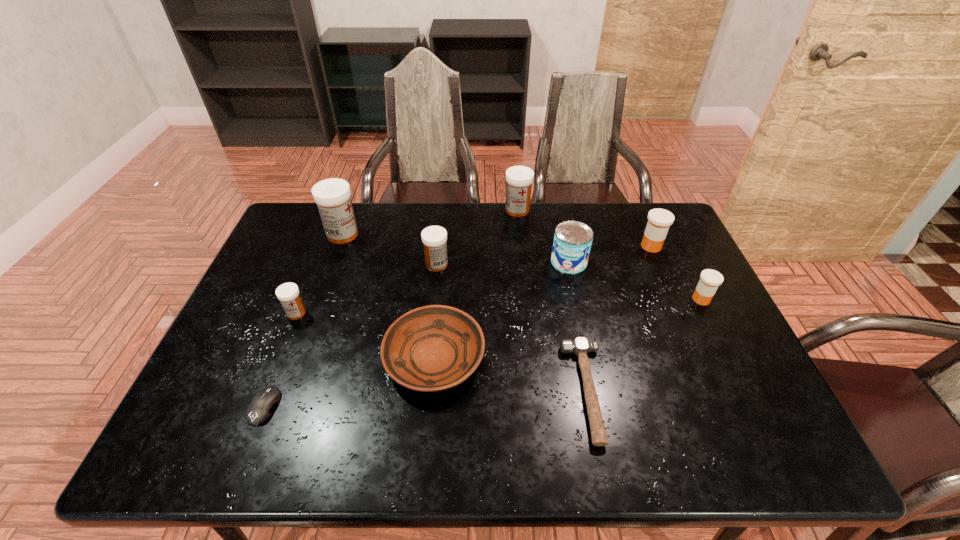
You are a GUI agent. You are given a task and a screenshot of the screen. Output one action in this format:
    pyautogui.click(x=<x>, y=<y>)
    Task: Click on the vacant space in between the second medicine from right to left and the hammer
    The height and width of the screenshot is (540, 960).
    Given the screenshot: What is the action you would take?
    pyautogui.click(x=619, y=319)

The width and height of the screenshot is (960, 540). Find the location of `vacant space in between the hammer and the blue can`. vacant space in between the hammer and the blue can is located at coordinates (578, 327).

Where is `object that stands as the seventh closest to the biggest white medicine`? This screenshot has width=960, height=540. object that stands as the seventh closest to the biggest white medicine is located at coordinates (580, 346).

Identify which object is the eighth nearest to the blue can. Please provide its 2D coordinates. Your answer should be formatted as a tuple, i.e. [(x, y)], where the tuple contains the x and y coordinates of a point satisfying the conditions above.

[(288, 293)]

You are a GUI agent. You are given a task and a screenshot of the screen. Output one action in this format:
    pyautogui.click(x=<x>, y=<y>)
    Task: Click on the medicine that is the fourth closest one to the second farthest white medicine
    This screenshot has width=960, height=540.
    Given the screenshot: What is the action you would take?
    pyautogui.click(x=659, y=220)

Identify which medicine is the second closest to the tallest medicine. Please provide its 2D coordinates. Your answer should be formatted as a tuple, i.e. [(x, y)], where the tuple contains the x and y coordinates of a point satisfying the conditions above.

[(288, 293)]

Find the location of a particular element. Image resolution: width=960 pixels, height=540 pixels. white medicine that stands as the third closest to the second tallest object is located at coordinates (288, 293).

Select which white medicine is the third closest to the black computer equipment. Please provide its 2D coordinates. Your answer should be formatted as a tuple, i.e. [(x, y)], where the tuple contains the x and y coordinates of a point satisfying the conditions above.

[(333, 196)]

Find the location of a particular element. The width and height of the screenshot is (960, 540). vacant region that satisfies the following two spatial constraints: 1. on the front side of the plate; 2. on the right side of the tallest object is located at coordinates (299, 358).

The height and width of the screenshot is (540, 960). What are the coordinates of `vacant space that satisfies the following two spatial constraints: 1. on the label of the rightmost medicine; 2. on the front side of the smallest white medicine` in the screenshot? It's located at (708, 313).